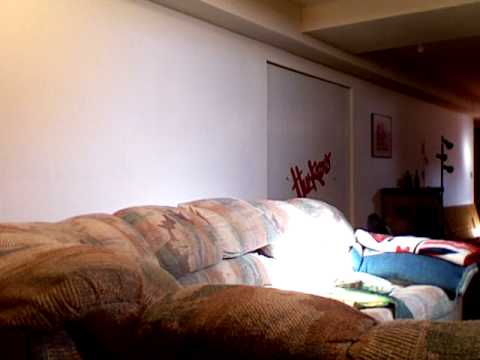
Locate an element on the screen. The height and width of the screenshot is (360, 480). ceiling is located at coordinates (462, 58).